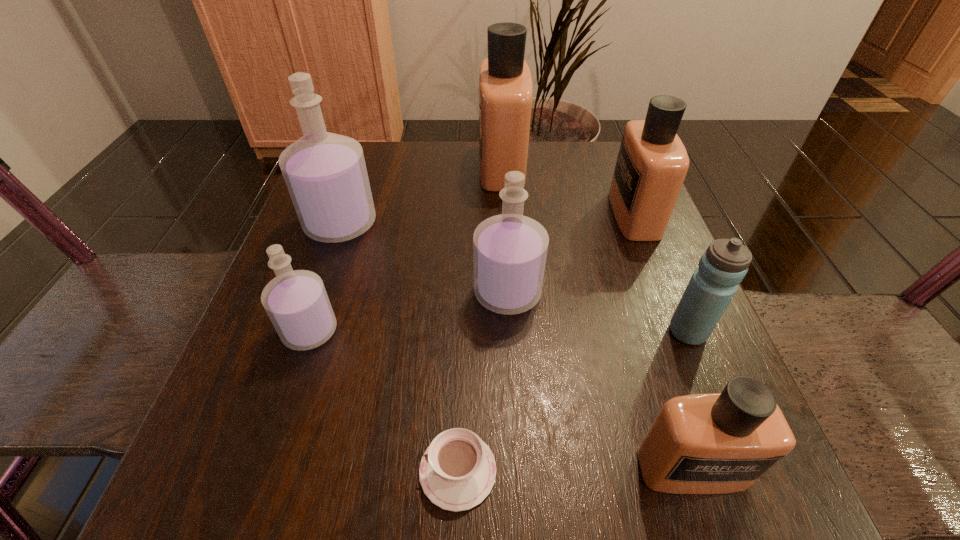
This screenshot has width=960, height=540. In order to click on free spot that satisfies the following two spatial constraints: 1. on the front label of the leftmost beige perfume; 2. on the front side of the farthest purple perfume in this screenshot , I will do `click(505, 224)`.

Where is `free location that satisfies the following two spatial constraints: 1. on the front side of the biggest purple perfume; 2. on the right side of the smallest purple perfume`? free location that satisfies the following two spatial constraints: 1. on the front side of the biggest purple perfume; 2. on the right side of the smallest purple perfume is located at coordinates (x=304, y=331).

I want to click on vacant space that satisfies the following two spatial constraints: 1. on the front label of the nearest beige perfume; 2. on the handle side of the teacup, so click(692, 471).